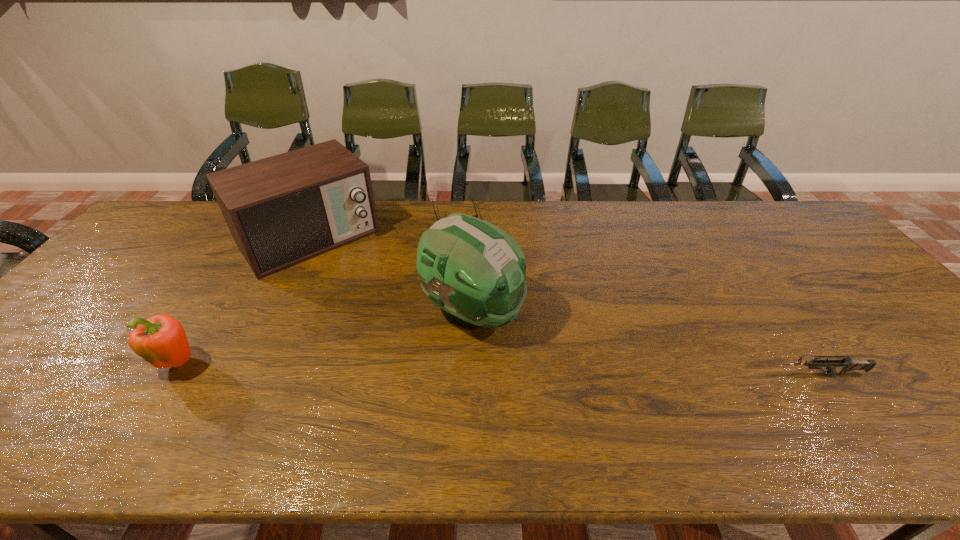
What are the coordinates of `radio receiver located in the far edge section of the desktop` in the screenshot? It's located at (281, 210).

I want to click on pepper that is positioned at the near edge, so click(161, 340).

Locate an element on the screen. This screenshot has height=540, width=960. gun that is positioned at the near edge is located at coordinates point(848,365).

The width and height of the screenshot is (960, 540). Identify the location of vacant space at the far edge of the desktop. (424, 201).

The height and width of the screenshot is (540, 960). Identify the location of vacant point at the near edge. (444, 381).

This screenshot has height=540, width=960. Find the location of `free region at the left edge of the desktop`. free region at the left edge of the desktop is located at coordinates (124, 279).

I want to click on vacant space at the far left corner of the desktop, so click(142, 234).

Where is `vacant space in between the second tallest object and the football helmet`? This screenshot has height=540, width=960. vacant space in between the second tallest object and the football helmet is located at coordinates (390, 274).

This screenshot has height=540, width=960. I want to click on free area in between the shortest object and the radio receiver, so click(381, 226).

At what (x,y) coordinates should I click in order to perform the action: click on free space between the gun and the radio receiver. Please return your answer as a coordinate pair (x, y). This screenshot has width=960, height=540. Looking at the image, I should click on (564, 305).